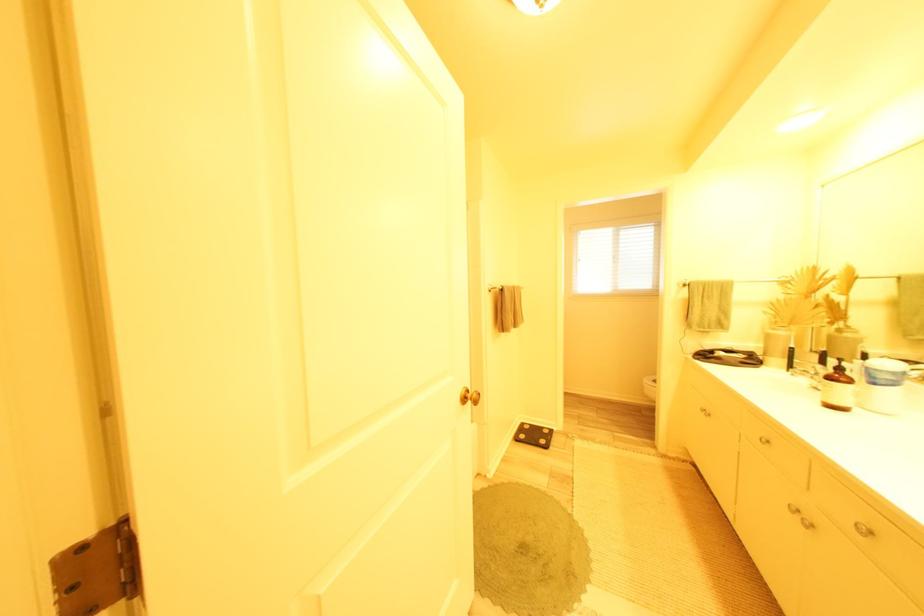
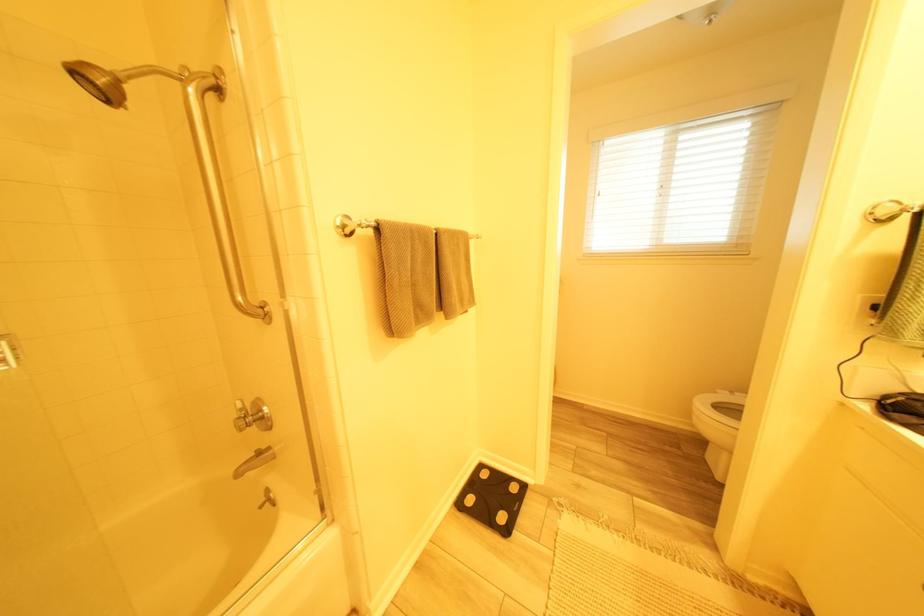
What movement of the cameraman would produce the second image?

The cameraman moved toward right, forward.